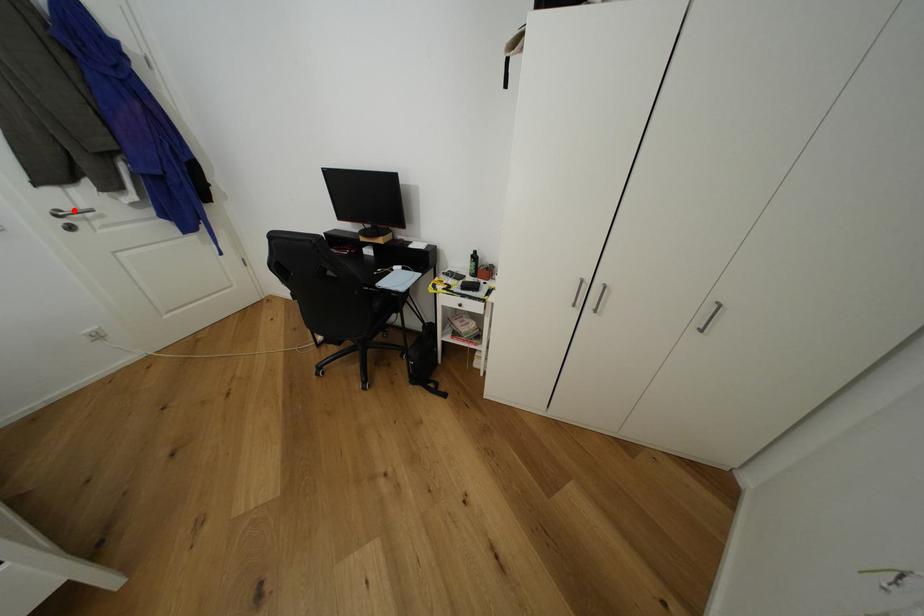
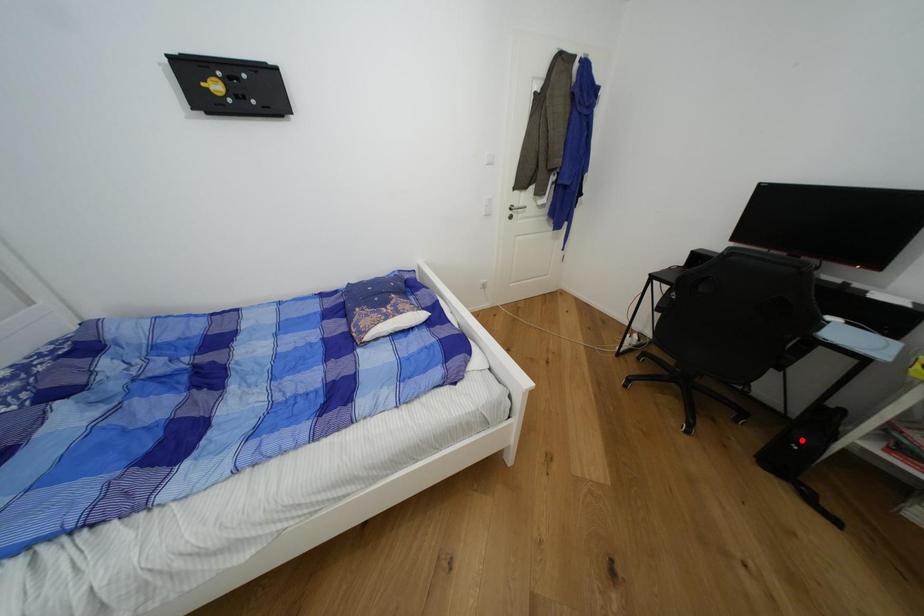
I am providing you with two images of the same scene from different viewpoints. A red point is marked on the first image and another point is marked on the second image. Do the highlighted points in image1 and image2 indicate the same real-world spot?

No